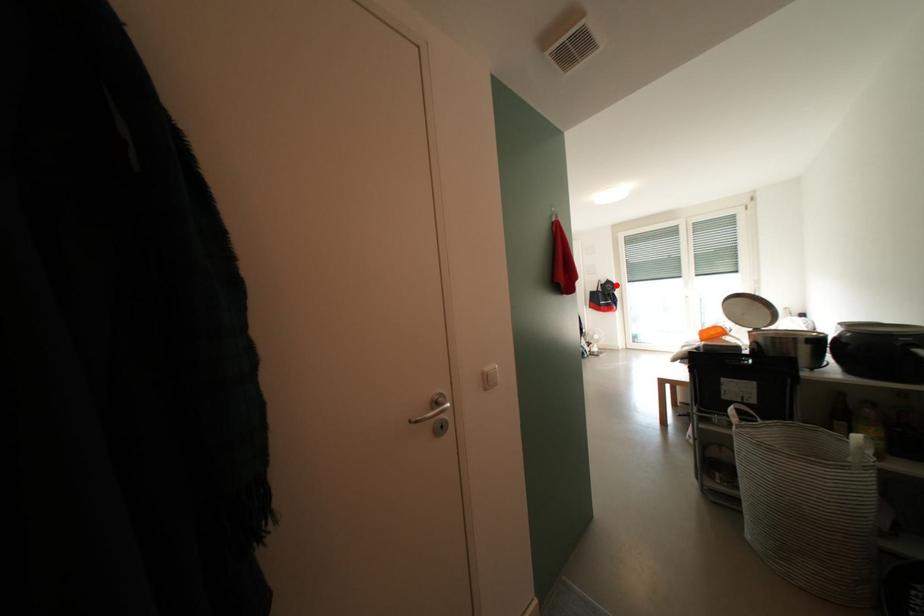
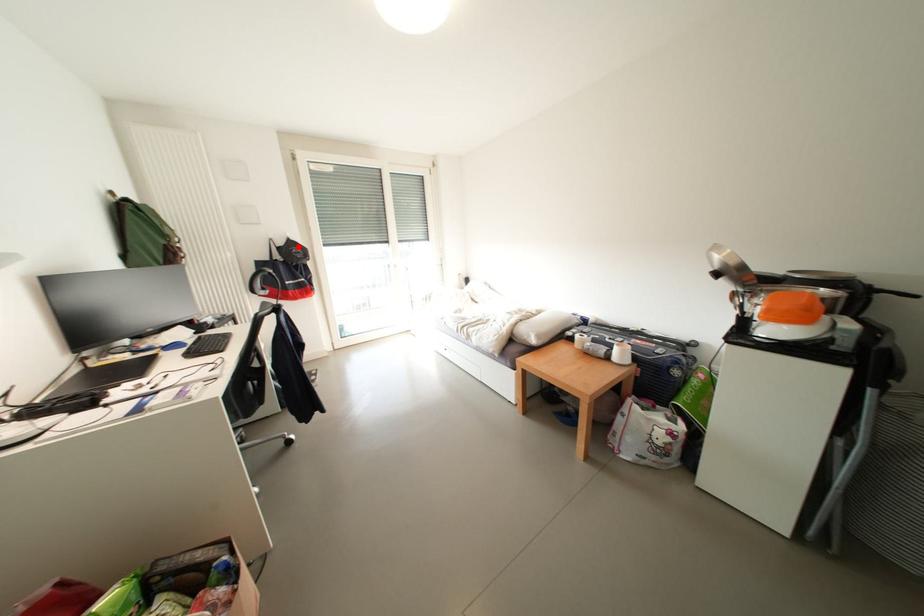
I am providing you with two images of the same scene from different viewpoints. A red point is marked on the first image and another point is marked on the second image. Does the point marked in image1 correspond to the same location as the one in image2?

Yes